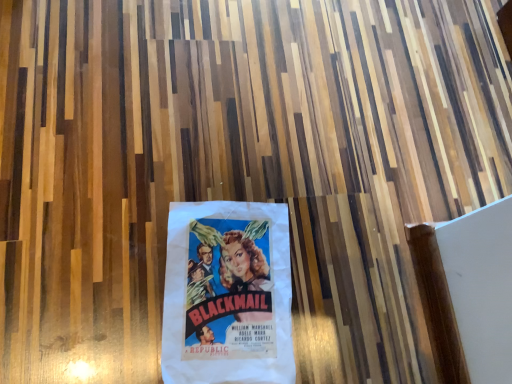
The width and height of the screenshot is (512, 384). What are the coordinates of `white paper poster at center` in the screenshot? It's located at (227, 294).

The height and width of the screenshot is (384, 512). Describe the element at coordinates (227, 294) in the screenshot. I see `white paper poster at center` at that location.

You are a GUI agent. You are given a task and a screenshot of the screen. Output one action in this format:
    pyautogui.click(x=<x>, y=<y>)
    Task: Click on the white paper poster at center
    This screenshot has height=384, width=512.
    Given the screenshot: What is the action you would take?
    pyautogui.click(x=227, y=294)